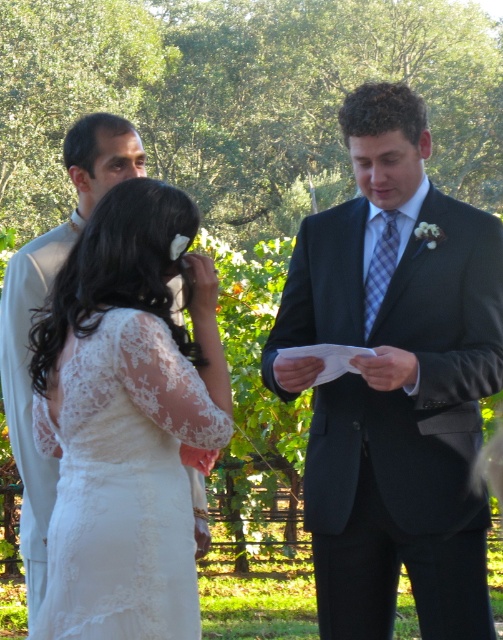
Who is more distant from viewer, (377, 612) or (63, 394)?

The point (377, 612) is behind.

Can you confirm if matte black suit at center is positioned above white lace dress at center?

Yes.

I want to click on matte black suit at center, so click(394, 381).